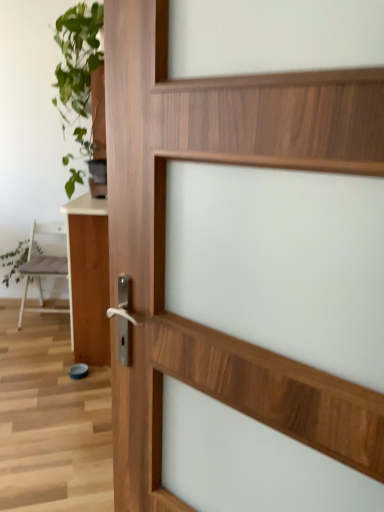
Question: Is white glossy table at left in front of or behind green leafy plant at left in the image?

Choices:
 (A) front
 (B) behind

Answer: (A)

Question: Is point (99, 268) positioned closer to the camera than point (8, 264)?

Choices:
 (A) closer
 (B) farther

Answer: (A)

Question: Which object is the closest to the green leafy plant at upper left?

Choices:
 (A) white glossy table at left
 (B) green leafy plant at left
 (C) white matte chair at left

Answer: (C)

Question: Considering the real-world distances, which object is closest to the green leafy plant at left?

Choices:
 (A) white matte chair at left
 (B) green leafy plant at upper left
 (C) white glossy table at left

Answer: (A)